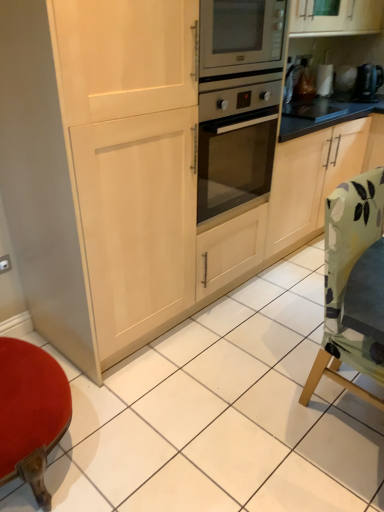
Question: Is metallic black kettle at upper right to the left or to the right of green fabric chair at lower right in the image?

Choices:
 (A) left
 (B) right

Answer: (B)

Question: In terms of size, does metallic black kettle at upper right appear bigger or smaller than green fabric chair at lower right?

Choices:
 (A) big
 (B) small

Answer: (B)

Question: Choose the correct answer: Is metallic black kettle at upper right inside green fabric chair at lower right or outside it?

Choices:
 (A) inside
 (B) outside

Answer: (B)

Question: Is green fabric chair at lower right in front of or behind metallic black kettle at upper right in the image?

Choices:
 (A) behind
 (B) front

Answer: (B)

Question: From a real-world perspective, is green fabric chair at lower right above or below metallic black kettle at upper right?

Choices:
 (A) below
 (B) above

Answer: (A)

Question: Is green fabric chair at lower right bigger or smaller than metallic black kettle at upper right?

Choices:
 (A) big
 (B) small

Answer: (A)

Question: Considering the positions of point (367, 346) and point (359, 81), is point (367, 346) closer or farther from the camera than point (359, 81)?

Choices:
 (A) farther
 (B) closer

Answer: (B)